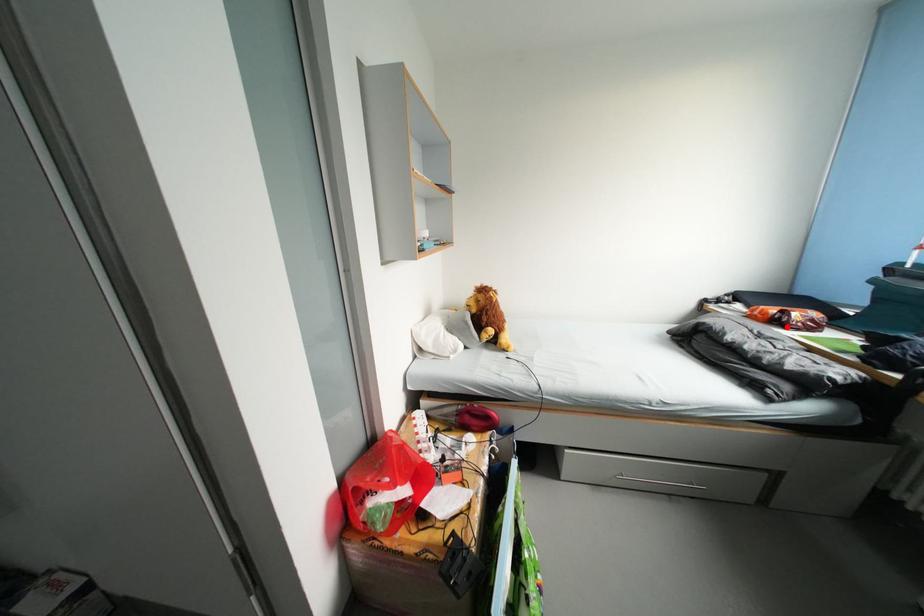
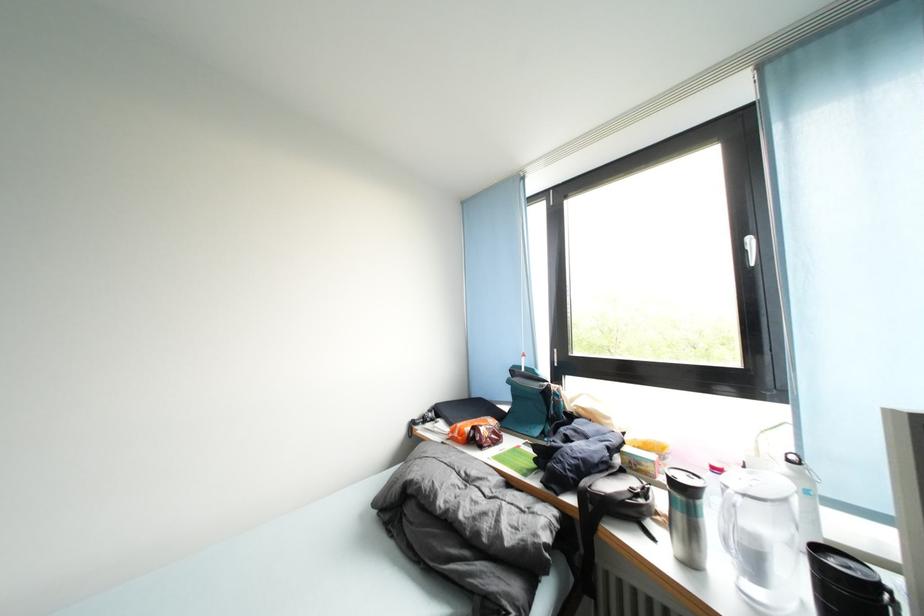
The point at the highlighted location is marked in the first image. Where is the corresponding point in the second image?

(482, 446)